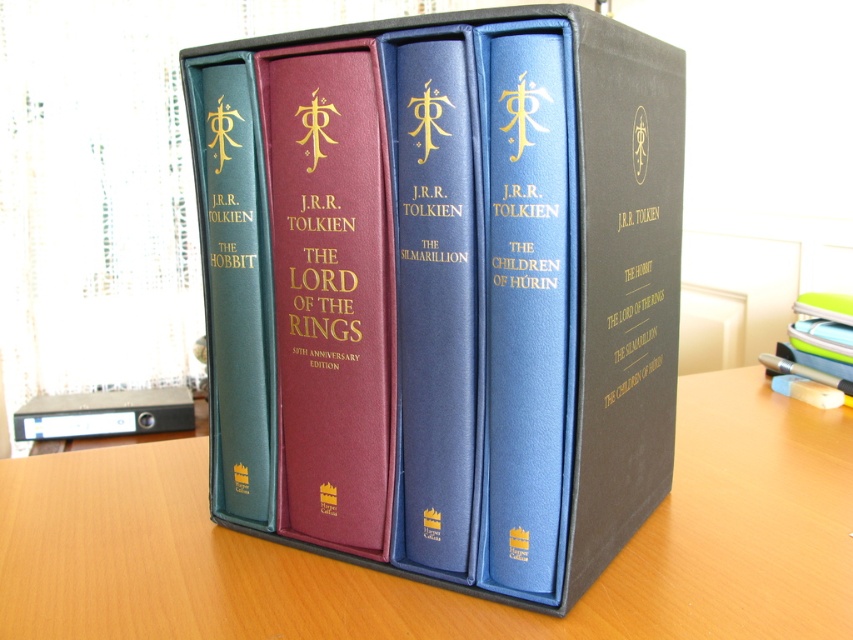
You are a book conservator trying to place a divider between the matte gold text at center and the black leather spine at center to prevent damage. The divider you have is 8 centimeters wide. Will it fit between them without overlapping?

The matte gold text at center and black leather spine at center are 9.67 centimeters apart. Since the divider is 8 centimeters wide, it will fit between them with 1.67 centimeters of space remaining on either side.

You are a book collector who wants to place a new book on the wooden table at center. The new book has a width of 20 centimeters. Can you fit it on the table without overlapping the matte gold text at center?

The wooden table at center is 37.60 centimeters away from the matte gold text at center. Since the new book is only 20 centimeters wide, there is enough space between them to place the book without overlapping.